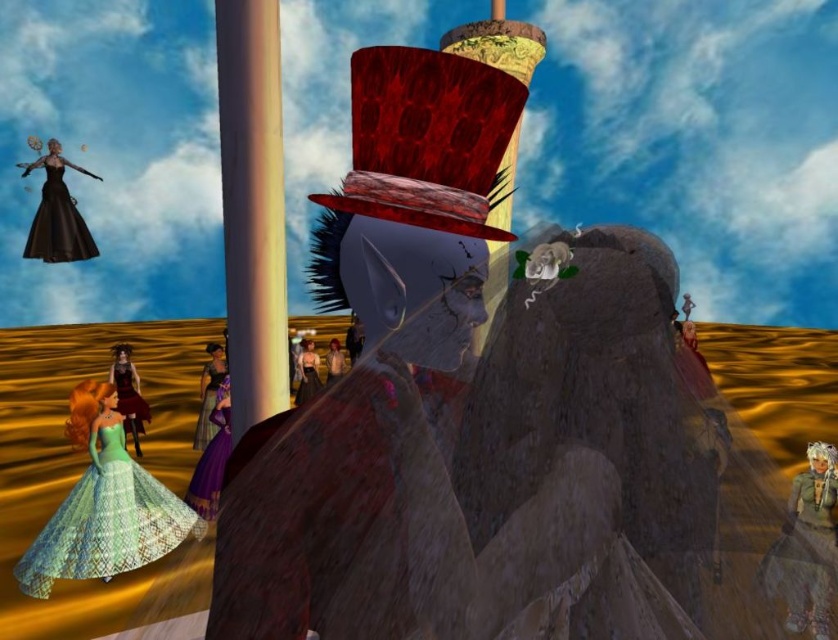
Who is shorter, shiny red velvet top hat at center or green lace dress at lower left?

shiny red velvet top hat at center

Does shiny red velvet top hat at center come behind green lace dress at lower left?

No, shiny red velvet top hat at center is closer to the viewer.

Between point (466, 168) and point (66, 509), which one is positioned in front?

Point (466, 168)

You are a GUI agent. You are given a task and a screenshot of the screen. Output one action in this format:
    pyautogui.click(x=<x>, y=<y>)
    Task: Click on the shiny red velvet top hat at center
    The width and height of the screenshot is (838, 640).
    Given the screenshot: What is the action you would take?
    pyautogui.click(x=427, y=138)

What do you see at coordinates (427, 138) in the screenshot? The image size is (838, 640). I see `shiny red velvet top hat at center` at bounding box center [427, 138].

Measure the distance between shiny red velvet top hat at center and matte gray dress at lower right.

shiny red velvet top hat at center is 9.21 feet from matte gray dress at lower right.

Identify the location of shiny red velvet top hat at center. The image size is (838, 640). (427, 138).

This screenshot has height=640, width=838. Identify the location of shiny red velvet top hat at center. (427, 138).

Is green lace dress at lower left bigger than shiny purple fabric dress at lower left?

Incorrect, green lace dress at lower left is not larger than shiny purple fabric dress at lower left.

Can you confirm if green lace dress at lower left is smaller than shiny purple fabric dress at lower left?

Yes, green lace dress at lower left is smaller than shiny purple fabric dress at lower left.

Is point (60, 572) closer to camera compared to point (120, 390)?

Yes, point (60, 572) is in front of point (120, 390).

This screenshot has width=838, height=640. I want to click on green lace dress at lower left, so [106, 520].